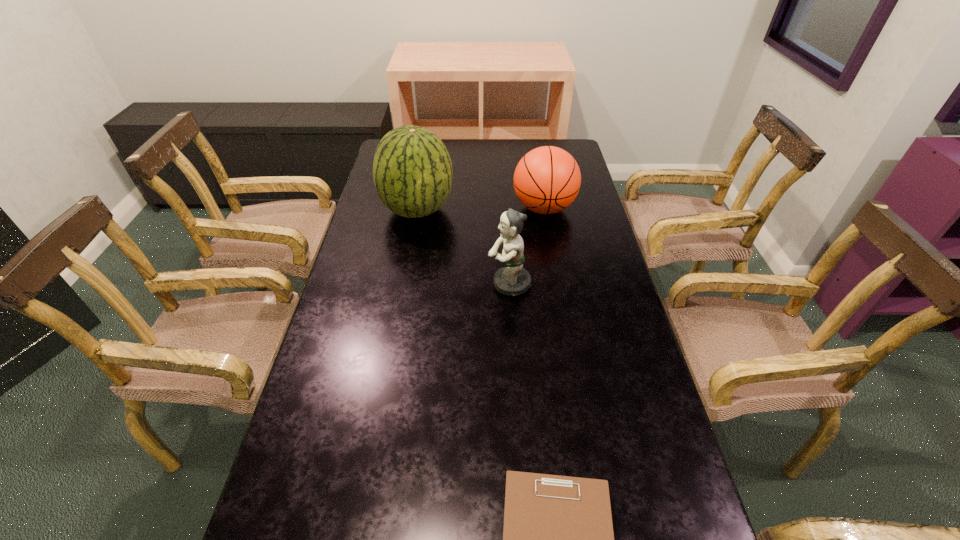
Locate an element on the screen. object present at the right edge is located at coordinates (547, 179).

Identify the location of vacant region at the far edge of the desktop. The height and width of the screenshot is (540, 960). (516, 155).

This screenshot has width=960, height=540. I want to click on vacant space at the left edge, so click(372, 336).

Find the location of a particular element. This screenshot has width=960, height=540. blank space at the right edge is located at coordinates (633, 485).

At what (x,y) coordinates should I click in order to perform the action: click on free region at the far right corner of the desktop. Please return your answer as a coordinate pair (x, y). This screenshot has height=540, width=960. Looking at the image, I should click on (562, 143).

The width and height of the screenshot is (960, 540). Find the location of `empty space between the leftmost object and the second nearest object`. empty space between the leftmost object and the second nearest object is located at coordinates (464, 247).

The height and width of the screenshot is (540, 960). What are the coordinates of `free space between the figurine and the basketball` in the screenshot? It's located at (526, 246).

Where is `free space between the basketball and the tallest object`? This screenshot has height=540, width=960. free space between the basketball and the tallest object is located at coordinates (481, 209).

This screenshot has height=540, width=960. What are the coordinates of `unoccupied position between the basketball and the watermelon` in the screenshot? It's located at (481, 209).

You are a GUI agent. You are given a task and a screenshot of the screen. Output one action in this format:
    pyautogui.click(x=<x>, y=<y>)
    Task: Click on the vacant space that's between the leftmost object and the basketball
    The width and height of the screenshot is (960, 540).
    Given the screenshot: What is the action you would take?
    481,209